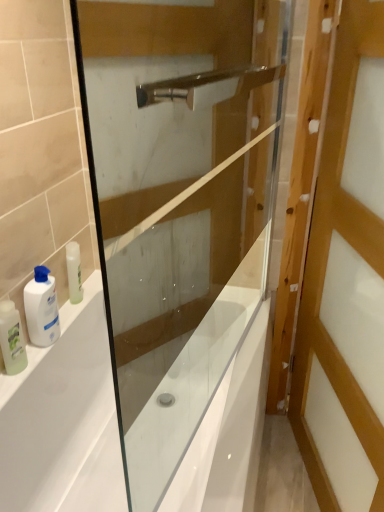
What do you see at coordinates (12, 338) in the screenshot? The width and height of the screenshot is (384, 512). I see `translucent plastic bottle at left, which appears as the first toiletry when viewed from the left` at bounding box center [12, 338].

This screenshot has height=512, width=384. I want to click on white glossy bathtub at lower left, so click(63, 420).

This screenshot has height=512, width=384. I want to click on translucent plastic bottle at left, arranged as the second toiletry when viewed from the right, so click(x=12, y=338).

Which object is further away from the camera, wooden door at right or white glossy bathtub at lower left?

white glossy bathtub at lower left is further away from the camera.

Which is behind, point (346, 316) or point (81, 369)?

The point (81, 369) is farther from the camera.

Could you tell me if wooden door at right is turned towards white glossy bathtub at lower left?

No, wooden door at right is not oriented towards white glossy bathtub at lower left.

Is wooden door at right thinner than white glossy bathtub at lower left?

Correct, the width of wooden door at right is less than that of white glossy bathtub at lower left.

From a real-world perspective, is wooden door at right beneath white glossy lotion at left, which appears as the first toiletry when viewed from the right?

No, from a real-world perspective, wooden door at right is not under white glossy lotion at left, which appears as the first toiletry when viewed from the right.

Is wooden door at right positioned in front of white glossy lotion at left, which is the 2th toiletry in left-to-right order?

Yes, wooden door at right is closer to the camera.

From the image's perspective, is wooden door at right located above white glossy lotion at left, which is the 2th toiletry in left-to-right order?

Incorrect, from the image's perspective, wooden door at right is lower than white glossy lotion at left, which is the 2th toiletry in left-to-right order.

Looking at their sizes, would you say white glossy lotion at left, which appears as the first toiletry when viewed from the right, is wider or thinner than wooden door at right?

In the image, white glossy lotion at left, which appears as the first toiletry when viewed from the right, appears to be more narrow than wooden door at right.

Is wooden door at right a part of white glossy lotion at left, which appears as the first toiletry when viewed from the right?

No, wooden door at right is not a part of white glossy lotion at left, which appears as the first toiletry when viewed from the right.

Measure the distance between white glossy lotion at left, which is the 2th toiletry in left-to-right order, and wooden door at right.

A distance of 34.95 inches exists between white glossy lotion at left, which is the 2th toiletry in left-to-right order, and wooden door at right.

Does point (46, 343) lie in front of point (303, 294)?

Yes, point (46, 343) is in front of point (303, 294).

Which of these two, transparent glass screen door at center or translucent plastic bottle at left, arranged as the second toiletry when viewed from the right, is wider?

With larger width is transparent glass screen door at center.

Is transparent glass screen door at center in contact with translucent plastic bottle at left, which appears as the first toiletry when viewed from the left?

No, transparent glass screen door at center is not in contact with translucent plastic bottle at left, which appears as the first toiletry when viewed from the left.

The height and width of the screenshot is (512, 384). In order to click on toiletry that is the 2nd object to the left of the transparent glass screen door at center, starting at the anchor in this screenshot , I will do `click(12, 338)`.

From the image's perspective, is white glossy bathtub at lower left over wooden door at right?

Actually, white glossy bathtub at lower left appears below wooden door at right in the image.

Which of these two, white glossy bathtub at lower left or wooden door at right, is bigger?

With larger size is white glossy bathtub at lower left.

Which is correct: white glossy bathtub at lower left is inside wooden door at right, or outside of it?

white glossy bathtub at lower left cannot be found inside wooden door at right.

Is white glossy bathtub at lower left beside wooden door at right?

No, white glossy bathtub at lower left is not in contact with wooden door at right.

Considering the relative sizes of white glossy bathtub at lower left and translucent plastic bottle at left, arranged as the second toiletry when viewed from the right, in the image provided, is white glossy bathtub at lower left shorter than translucent plastic bottle at left, arranged as the second toiletry when viewed from the right,?

In fact, white glossy bathtub at lower left may be taller than translucent plastic bottle at left, arranged as the second toiletry when viewed from the right.

From the image's perspective, relative to translucent plastic bottle at left, which appears as the first toiletry when viewed from the left, is white glossy bathtub at lower left above or below?

Clearly, from the image's perspective, white glossy bathtub at lower left is below translucent plastic bottle at left, which appears as the first toiletry when viewed from the left.

Which is in front, point (67, 390) or point (20, 353)?

The point (20, 353) is in front.

Are white glossy bathtub at lower left and translucent plastic bottle at left, arranged as the second toiletry when viewed from the right, far apart?

white glossy bathtub at lower left is near translucent plastic bottle at left, arranged as the second toiletry when viewed from the right, not far away.

Considering the relative sizes of white glossy lotion at left, which is the 2th toiletry in left-to-right order, and white glossy bathtub at lower left in the image provided, is white glossy lotion at left, which is the 2th toiletry in left-to-right order, wider than white glossy bathtub at lower left?

No, white glossy lotion at left, which is the 2th toiletry in left-to-right order, is not wider than white glossy bathtub at lower left.

In terms of height, does white glossy lotion at left, which appears as the first toiletry when viewed from the right, look taller or shorter compared to white glossy bathtub at lower left?

Considering their sizes, white glossy lotion at left, which appears as the first toiletry when viewed from the right, has less height than white glossy bathtub at lower left.

Is the depth of white glossy lotion at left, which is the 2th toiletry in left-to-right order, less than that of white glossy bathtub at lower left?

No.

Could you tell me if white glossy lotion at left, which appears as the first toiletry when viewed from the right, is turned towards white glossy bathtub at lower left?

No.

Identify the location of bath below the wooden door at right (from a real-world perspective). This screenshot has width=384, height=512. (63, 420).

Identify the location of door in front of the white glossy lotion at left, which is the 2th toiletry in left-to-right order. The height and width of the screenshot is (512, 384). (346, 281).

Based on the photo, considering their positions, is white glossy lotion at left, which is the 2th toiletry in left-to-right order, positioned further to transparent glass screen door at center than white glossy bathtub at lower left?

white glossy lotion at left, which is the 2th toiletry in left-to-right order, is positioned further to the anchor transparent glass screen door at center.

Considering their positions, is white glossy lotion at left, which appears as the first toiletry when viewed from the right, positioned further to wooden door at right than translucent plastic bottle at left, arranged as the second toiletry when viewed from the right?

translucent plastic bottle at left, arranged as the second toiletry when viewed from the right, lies further to wooden door at right than the other object.

Considering their positions, is white glossy lotion at left, which appears as the first toiletry when viewed from the right, positioned closer to white glossy bathtub at lower left than wooden door at right?

white glossy lotion at left, which appears as the first toiletry when viewed from the right, lies closer to white glossy bathtub at lower left than the other object.

Estimate the real-world distances between objects in this image. Which object is closer to transparent glass screen door at center, wooden door at right or white glossy bathtub at lower left?

white glossy bathtub at lower left lies closer to transparent glass screen door at center than the other object.

When comparing their distances from white glossy bathtub at lower left, does white glossy lotion at left, which appears as the first toiletry when viewed from the right, or transparent glass screen door at center seem further?

Among the two, transparent glass screen door at center is located further to white glossy bathtub at lower left.

Which object lies further to the anchor point translucent plastic bottle at left, which appears as the first toiletry when viewed from the left, transparent glass screen door at center or white glossy bathtub at lower left?

Among the two, transparent glass screen door at center is located further to translucent plastic bottle at left, which appears as the first toiletry when viewed from the left.

When comparing their distances from white glossy bathtub at lower left, does wooden door at right or white glossy lotion at left, which appears as the first toiletry when viewed from the right, seem closer?

Among the two, white glossy lotion at left, which appears as the first toiletry when viewed from the right, is located nearer to white glossy bathtub at lower left.

Based on their spatial positions, is translucent plastic bottle at left, arranged as the second toiletry when viewed from the right, or wooden door at right further from transparent glass screen door at center?

translucent plastic bottle at left, arranged as the second toiletry when viewed from the right, is positioned further to the anchor transparent glass screen door at center.

Locate an element on the screen. The image size is (384, 512). toiletry between transparent glass screen door at center and white glossy lotion at left, which is the 2th toiletry in left-to-right order, along the z-axis is located at coordinates (12, 338).

Find the location of a particular element. The image size is (384, 512). bath between transparent glass screen door at center and translucent plastic bottle at left, which appears as the first toiletry when viewed from the left, in the front-back direction is located at coordinates (63, 420).

Identify the location of screen door located between translucent plastic bottle at left, which appears as the first toiletry when viewed from the left, and wooden door at right in the left-right direction. (178, 202).

This screenshot has height=512, width=384. I want to click on toiletry between white glossy bathtub at lower left and white glossy lotion at left, which is the 2th toiletry in left-to-right order, from front to back, so click(12, 338).